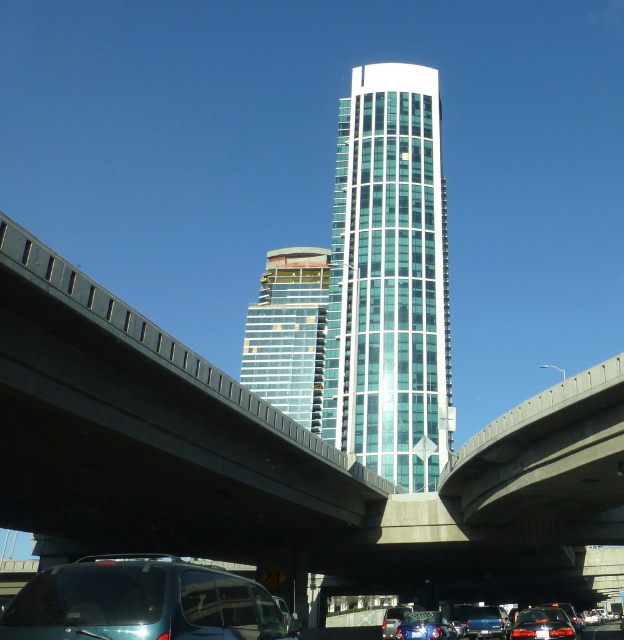
Question: Considering the real-world distances, which object is farthest from the teal glossy minivan at lower left?

Choices:
 (A) metallic silver sedan at lower center
 (B) translucent glass building at center
 (C) concrete bridge at center

Answer: (B)

Question: From the image, what is the correct spatial relationship of translucent glass building at center in relation to matte black sedan at lower center?

Choices:
 (A) above
 (B) below

Answer: (A)

Question: Among these points, which one is nearest to the camera?

Choices:
 (A) (407, 637)
 (B) (69, 634)
 (C) (29, 529)
 (D) (535, 609)

Answer: (B)

Question: Estimate the real-world distances between objects in this image. Which object is farther from the matte black sedan at lower center?

Choices:
 (A) metallic blue van at center
 (B) metallic silver sedan at lower center

Answer: (B)

Question: Does shiny black sedan at lower center come in front of metallic blue van at center?

Choices:
 (A) yes
 (B) no

Answer: (A)

Question: Does concrete bridge at center appear on the right side of transparent glass tower at center?

Choices:
 (A) yes
 (B) no

Answer: (B)